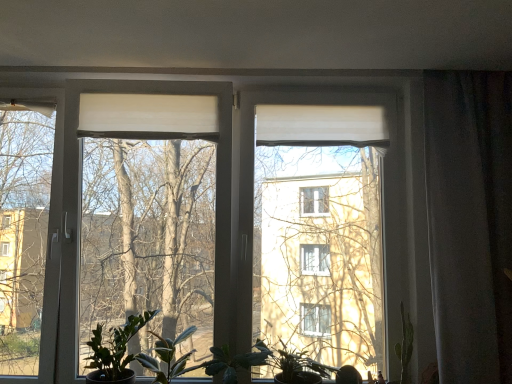
Question: Considering the positions of point (163, 367) and point (250, 357), is point (163, 367) closer or farther from the camera than point (250, 357)?

Choices:
 (A) farther
 (B) closer

Answer: (B)

Question: Considering their positions, is green matte leafy plant at lower center, the 2th houseplant in the left-to-right sequence, located in front of or behind green matte leafy plant at center?

Choices:
 (A) front
 (B) behind

Answer: (B)

Question: Based on their relative distances, which object is nearer to the green matte plant at lower left, the first houseplant in the left-to-right sequence?

Choices:
 (A) green matte plant at lower center, marked as the first houseplant in a right-to-left arrangement
 (B) green matte leafy plant at lower center, arranged as the 2th houseplant when viewed from the right
 (C) white matte curtain at right
 (D) green matte leafy plant at center

Answer: (B)

Question: Considering the real-world distances, which object is closest to the green matte plant at lower left, the first houseplant in the left-to-right sequence?

Choices:
 (A) white matte curtain at right
 (B) green matte leafy plant at lower center, arranged as the 2th houseplant when viewed from the right
 (C) green matte leafy plant at center
 (D) green matte plant at lower center, marked as the first houseplant in a right-to-left arrangement

Answer: (B)